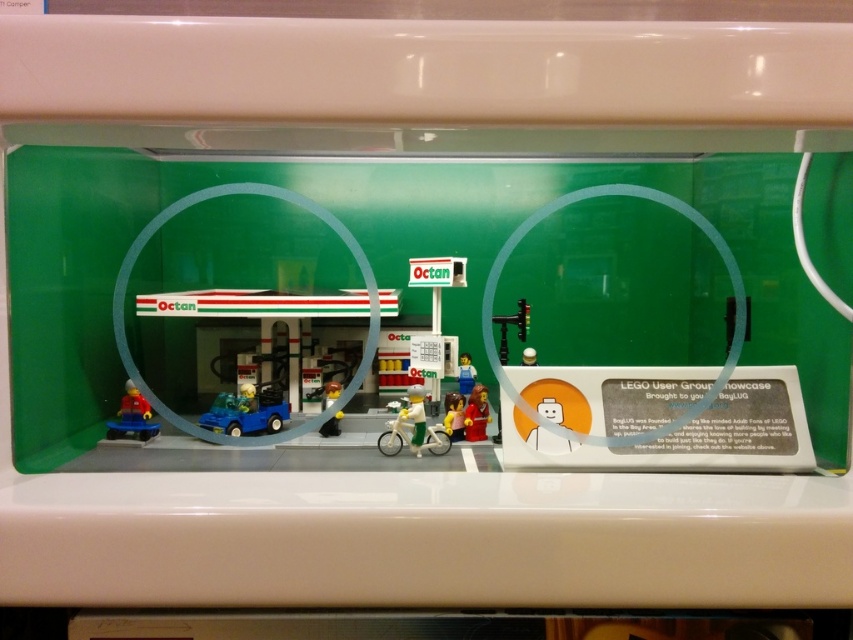
Question: Which of these objects is positioned farthest from the white plastic figure at center?

Choices:
 (A) white matte figure at center
 (B) blue plastic car at center
 (C) smooth red figure at center

Answer: (A)

Question: Which is nearer to the white matte bicycle at center?

Choices:
 (A) smooth plastic bicycle at center
 (B) white plastic figure at center

Answer: (A)

Question: Is matte blue car at lower left to the right of white plastic figure at center from the viewer's perspective?

Choices:
 (A) no
 (B) yes

Answer: (A)

Question: Does matte blue car at lower left appear on the left side of white plastic figure at center?

Choices:
 (A) yes
 (B) no

Answer: (A)

Question: Can you confirm if matte blue car at lower left is wider than smooth plastic figure at center?

Choices:
 (A) yes
 (B) no

Answer: (A)

Question: Among these points, which one is farthest from the camera?

Choices:
 (A) (267, 403)
 (B) (525, 486)

Answer: (A)